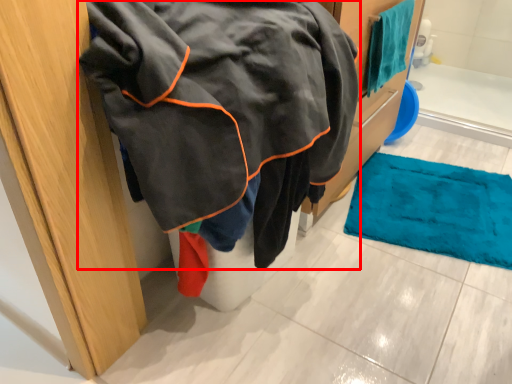
Question: From the image, what is the correct spatial relationship of jacket (annotated by the red box) in relation to towel?

Choices:
 (A) left
 (B) right

Answer: (A)